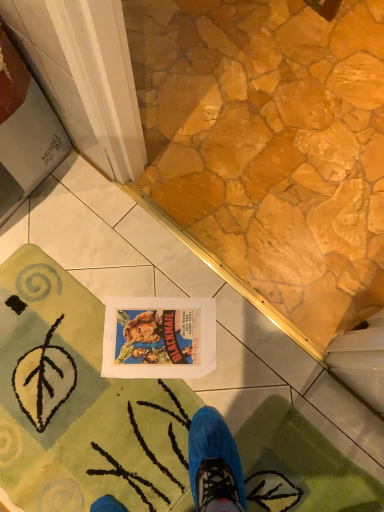
Question: Is green plush bath mat at lower left, the 2th bath mat positioned from the right, taller or shorter than green plush bath mat at lower left, the 2th bath mat from the left?

Choices:
 (A) tall
 (B) short

Answer: (B)

Question: Considering the positions of green plush bath mat at lower left, which is the first bath mat from left to right, and green plush bath mat at lower left, the 2th bath mat from the left, in the image, is green plush bath mat at lower left, which is the first bath mat from left to right, wider or thinner than green plush bath mat at lower left, the 2th bath mat from the left,?

Choices:
 (A) thin
 (B) wide

Answer: (B)

Question: Considering their positions, is green plush bath mat at lower left, which is the first bath mat from left to right, located in front of or behind green plush bath mat at lower left, the 1th bath mat in the right-to-left sequence?

Choices:
 (A) behind
 (B) front

Answer: (A)

Question: From the image's perspective, is green plush bath mat at lower left, the 1th bath mat in the right-to-left sequence, above or below green plush bath mat at lower left, which is the first bath mat from left to right?

Choices:
 (A) above
 (B) below

Answer: (B)

Question: Do you think green plush bath mat at lower left, the 2th bath mat from the left, is within green plush bath mat at lower left, which is the first bath mat from left to right, or outside of it?

Choices:
 (A) outside
 (B) inside

Answer: (A)

Question: In the image, is green plush bath mat at lower left, the 1th bath mat in the right-to-left sequence, positioned in front of or behind green plush bath mat at lower left, the 2th bath mat positioned from the right?

Choices:
 (A) behind
 (B) front

Answer: (B)

Question: In terms of size, does green plush bath mat at lower left, the 1th bath mat in the right-to-left sequence, appear bigger or smaller than green plush bath mat at lower left, which is the first bath mat from left to right?

Choices:
 (A) small
 (B) big

Answer: (A)